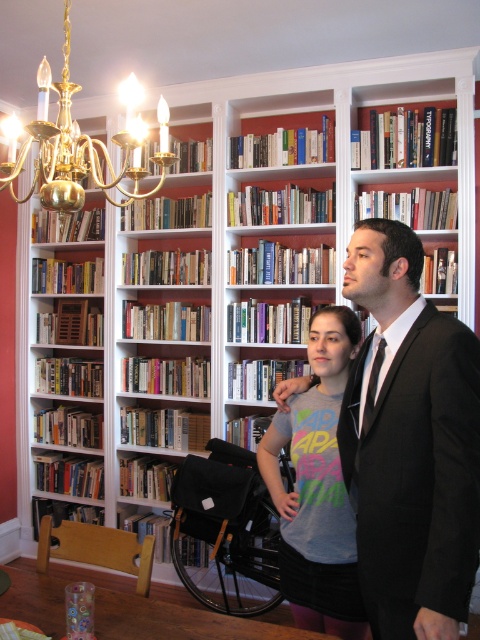
Describe the element at coordinates (410, 444) in the screenshot. I see `black suit at center` at that location.

Between black suit at center and black leather wheelchair at center, which one is positioned lower?

black leather wheelchair at center is below.

Describe the element at coordinates (410, 444) in the screenshot. Image resolution: width=480 pixels, height=640 pixels. I see `black suit at center` at that location.

Find the location of a particular element. black suit at center is located at coordinates (410, 444).

Does light gray t-shirt at center come in front of black silk tie at right?

No, it is not.

Between point (302, 456) and point (372, 410), which one is positioned behind?

The point (302, 456) is more distant.

Find the location of a particular element. The height and width of the screenshot is (640, 480). light gray t-shirt at center is located at coordinates (317, 488).

Is gold brass chandelier at upper left to the right of black silk tie at right from the viewer's perspective?

Incorrect, gold brass chandelier at upper left is not on the right side of black silk tie at right.

Is gold brass chandelier at upper left thinner than black silk tie at right?

In fact, gold brass chandelier at upper left might be wider than black silk tie at right.

The height and width of the screenshot is (640, 480). Identify the location of gold brass chandelier at upper left. (83, 145).